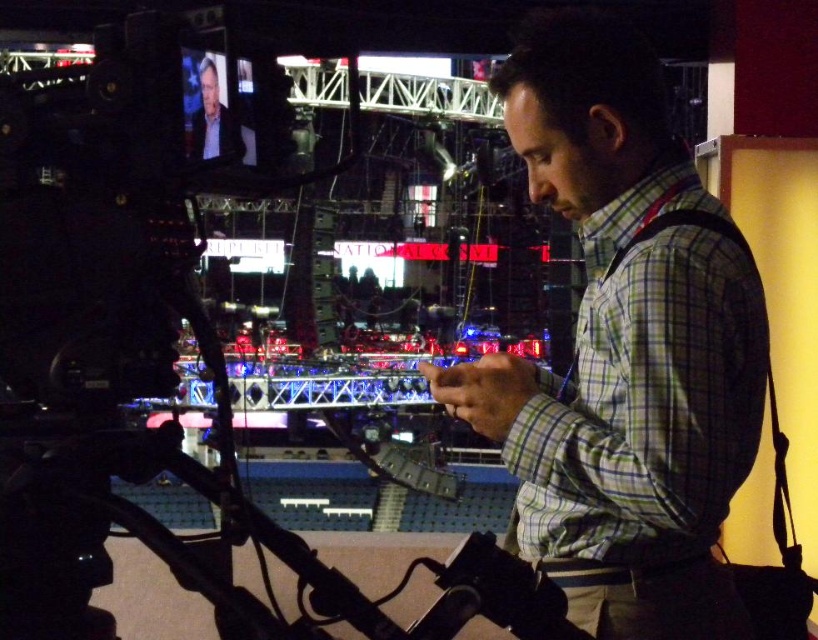
You are a photographer in the studio. You need to decide which clothing item, the green checkered shirt at center or the light gray suit at upper left, would require a wider camera frame to capture fully. Which one do you choose?

The green checkered shirt at center has a larger width than the light gray suit at upper left, so you should choose the green checkered shirt at center to require a wider camera frame.

You are a camera operator in the studio. You need to adjust your camera to focus on the green checkered shirt at center. What are the 2D coordinates where you should aim the camera?

The 2D coordinates for the green checkered shirt at center are at point (623, 349). You should aim the camera at those coordinates to focus on the green checkered shirt at center.